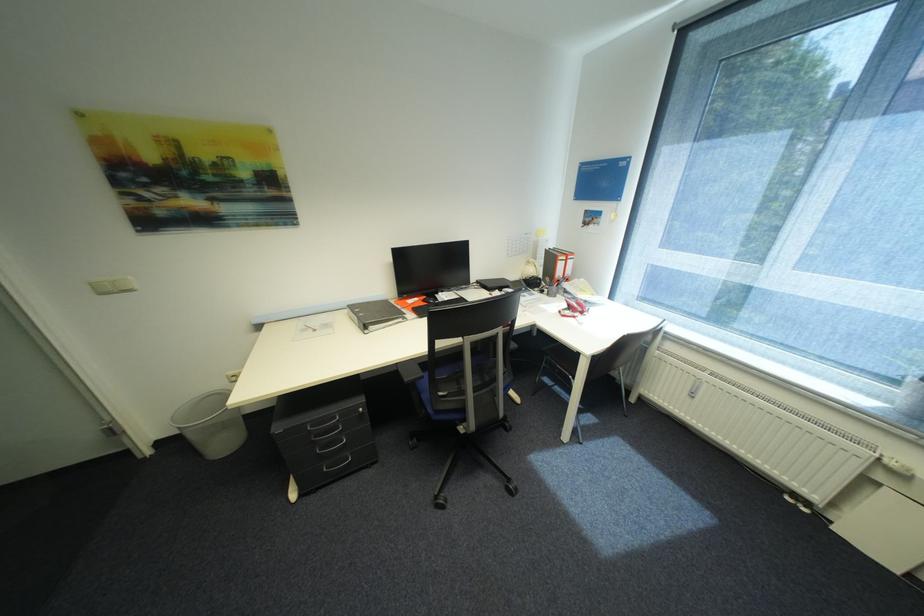
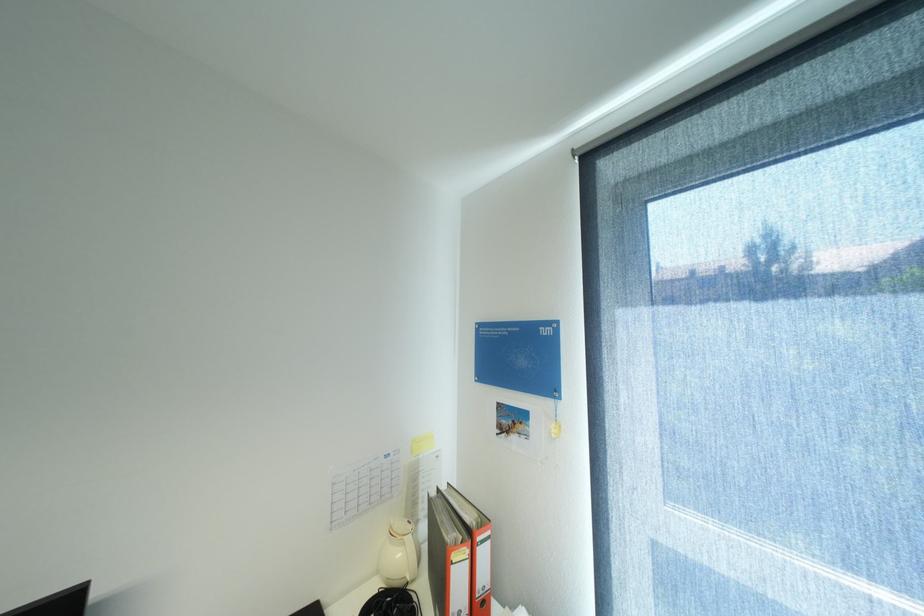
In the second image, find the point that corresponds to point (540, 270) in the first image.

(407, 554)